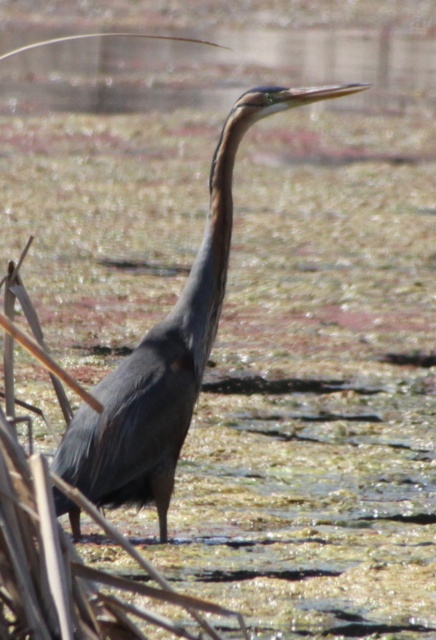
You are a photographer aiming to capture the Great Blue Heron in the image. The heron is located at point (169, 349). You want to adjust your camera to focus on the heron. Is the point you are aiming at the correct location for focusing on the heron?

Yes, the point (169, 349) corresponds to the shiny dark blue heron at center, so focusing there will correctly capture the heron.

You are a birdwatcher observing the scene. You notice two objects labeled as the shiny dark blue heron at center and the shiny purple neck at center. Which one do you think is larger in size?

The shiny dark blue heron at center is bigger than the shiny purple neck at center, so the shiny dark blue heron at center is larger in size.